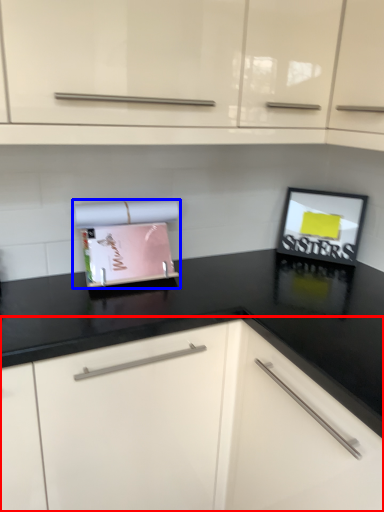
Question: Which of the following is the farthest to the observer, cabinetry (highlighted by a red box) or appliance (highlighted by a blue box)?

Choices:
 (A) cabinetry
 (B) appliance

Answer: (B)